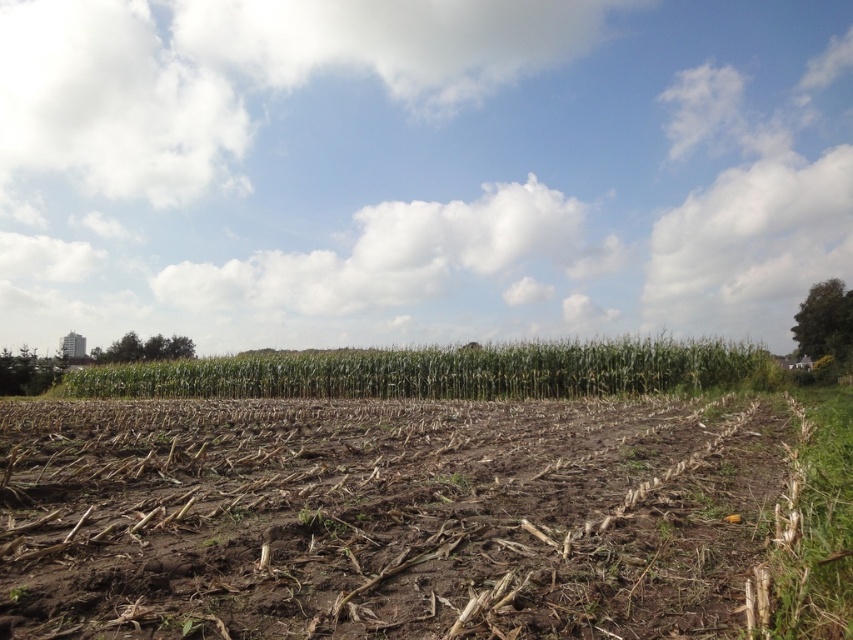
You are a farmer checking the soil and crops. You notice the brown dirt at center and the green leafy corn at center in the field. Which one has a narrower width?

The brown dirt at center has a narrower width than the green leafy corn at center.

You are standing in the rural landscape and want to walk from your current position to the point marked at coordinates point (x=372, y=538) and point (x=722, y=384). Which point should you head towards first if you want to reach the one that is closer to you?

Point (x=372, y=538) is in front of point (x=722, y=384), so you should head towards point (x=372, y=538) first since it is closer to you.